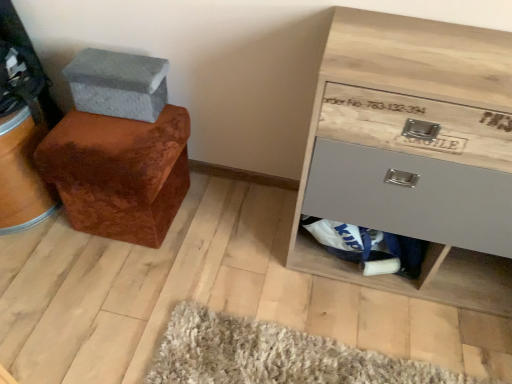
Question: Considering the relative positions of gray fabric shoe box at upper left and wooden chest of drawers at lower right in the image provided, is gray fabric shoe box at upper left behind wooden chest of drawers at lower right?

Choices:
 (A) no
 (B) yes

Answer: (B)

Question: Considering the relative sizes of gray fabric shoe box at upper left and wooden chest of drawers at lower right in the image provided, is gray fabric shoe box at upper left thinner than wooden chest of drawers at lower right?

Choices:
 (A) no
 (B) yes

Answer: (B)

Question: Can you confirm if gray fabric shoe box at upper left is shorter than wooden chest of drawers at lower right?

Choices:
 (A) no
 (B) yes

Answer: (B)

Question: Is gray fabric shoe box at upper left closer to camera compared to wooden chest of drawers at lower right?

Choices:
 (A) no
 (B) yes

Answer: (A)

Question: Can you confirm if gray fabric shoe box at upper left is positioned to the right of wooden chest of drawers at lower right?

Choices:
 (A) no
 (B) yes

Answer: (A)

Question: Does gray fabric shoe box at upper left appear on the left side of wooden chest of drawers at lower right?

Choices:
 (A) yes
 (B) no

Answer: (A)

Question: Would you say matte gray drawer at lower right contains velvet brown ottoman at left?

Choices:
 (A) yes
 (B) no

Answer: (B)

Question: From the image's perspective, is matte gray drawer at lower right located beneath velvet brown ottoman at left?

Choices:
 (A) no
 (B) yes

Answer: (B)

Question: Are matte gray drawer at lower right and velvet brown ottoman at left far apart?

Choices:
 (A) no
 (B) yes

Answer: (A)

Question: Considering the relative positions of matte gray drawer at lower right and velvet brown ottoman at left in the image provided, is matte gray drawer at lower right to the right of velvet brown ottoman at left from the viewer's perspective?

Choices:
 (A) yes
 (B) no

Answer: (A)

Question: Considering the relative sizes of matte gray drawer at lower right and velvet brown ottoman at left in the image provided, is matte gray drawer at lower right smaller than velvet brown ottoman at left?

Choices:
 (A) yes
 (B) no

Answer: (A)

Question: Would you say matte gray drawer at lower right is outside velvet brown ottoman at left?

Choices:
 (A) no
 (B) yes

Answer: (B)

Question: Can you see wooden chest of drawers at lower right touching matte gray drawer at lower right?

Choices:
 (A) yes
 (B) no

Answer: (B)